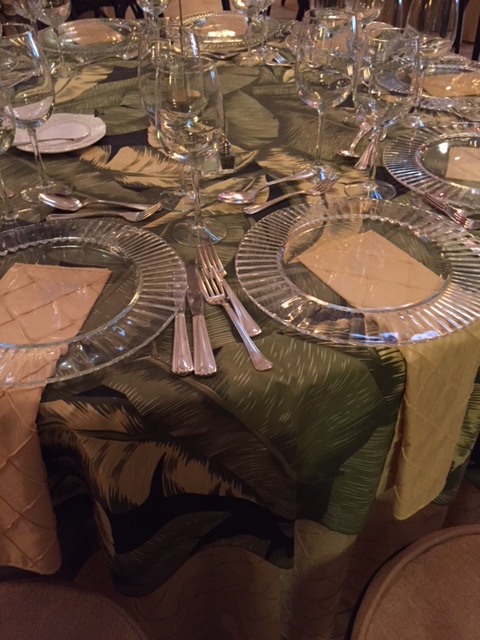
Find the location of a particular element. The height and width of the screenshot is (640, 480). silver spoon is located at coordinates (x=71, y=200), (x=238, y=196), (x=347, y=154).